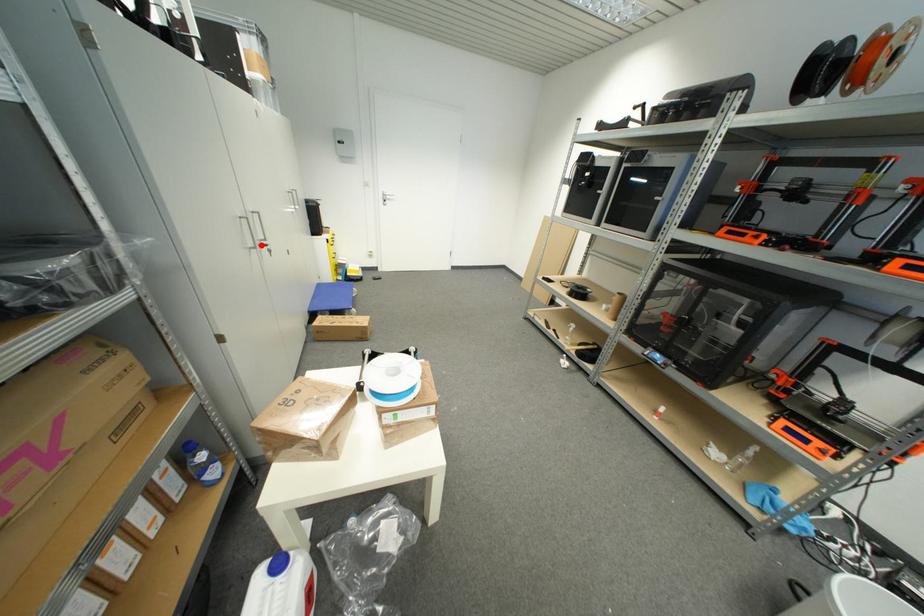
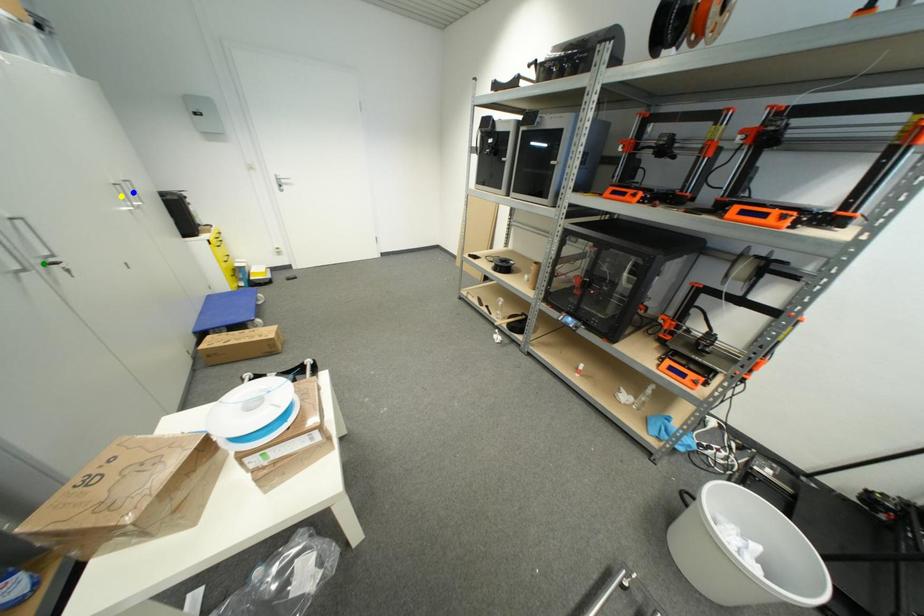
Question: I am providing you with two images of the same scene from different viewpoints. A red point is marked on the first image. You are given multiple points on the second image. Which mark in image 2 goes with the point in image 1?

Choices:
 (A) green point
 (B) blue point
 (C) yellow point

Answer: (A)